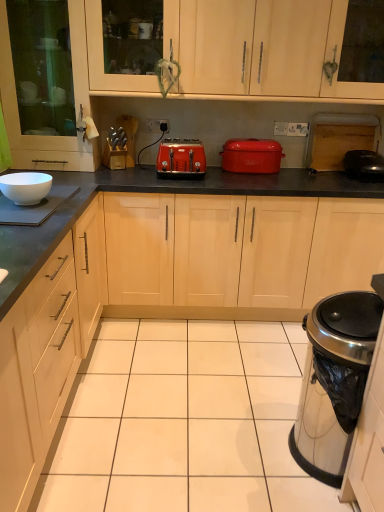
This screenshot has width=384, height=512. What are the coordinates of `matte wood cabinet at left, marked as the second cabinetry in a right-to-left arrangement` in the screenshot? It's located at (45, 84).

Looking at this image, measure the distance between black glossy pan at right, which is the third appliance in bottom-to-top order, and camera.

The distance of black glossy pan at right, which is the third appliance in bottom-to-top order, from camera is 8.03 feet.

This screenshot has width=384, height=512. What do you see at coordinates (364, 165) in the screenshot?
I see `black glossy pan at right, arranged as the 3th appliance when viewed from the left` at bounding box center [364, 165].

What do you see at coordinates (152, 192) in the screenshot? I see `black granite countertop at center` at bounding box center [152, 192].

You are a GUI agent. You are given a task and a screenshot of the screen. Output one action in this format:
    pyautogui.click(x=<x>, y=<y>)
    Task: Click on the matte wood cabinet at left, marked as the second cabinetry in a right-to-left arrangement
    The image size is (384, 512).
    Given the screenshot: What is the action you would take?
    pyautogui.click(x=45, y=84)

Looking at their sizes, would you say satin silver trash can at lower right, which ranks as the second appliance in right-to-left order, is wider or thinner than white plastic electric outlet at center?

Considering their sizes, satin silver trash can at lower right, which ranks as the second appliance in right-to-left order, looks broader than white plastic electric outlet at center.

Between satin silver trash can at lower right, the 3th appliance in the top-to-bottom sequence, and white plastic electric outlet at center, which one has smaller size?

Smaller between the two is white plastic electric outlet at center.

How different are the orientations of satin silver trash can at lower right, the third appliance in the back-to-front sequence, and white plastic electric outlet at center in degrees?

The angular difference between satin silver trash can at lower right, the third appliance in the back-to-front sequence, and white plastic electric outlet at center is 90.5 degrees.

From the picture: Which is correct: satin silver trash can at lower right, positioned as the 2th appliance in left-to-right order, is inside white plastic electric outlet at center, or outside of it?

satin silver trash can at lower right, positioned as the 2th appliance in left-to-right order, lies outside white plastic electric outlet at center.

Is there a large distance between black glossy pan at right, placed as the 1th appliance when sorted from right to left, and white matte bowl at left?

Yes, black glossy pan at right, placed as the 1th appliance when sorted from right to left, and white matte bowl at left are located far from each other.

Considering the relative sizes of black glossy pan at right, arranged as the 1th appliance when viewed from the back, and white matte bowl at left in the image provided, is black glossy pan at right, arranged as the 1th appliance when viewed from the back, bigger than white matte bowl at left?

Correct, black glossy pan at right, arranged as the 1th appliance when viewed from the back, is larger in size than white matte bowl at left.

Which of these two, black glossy pan at right, arranged as the 1th appliance when viewed from the back, or white matte bowl at left, stands shorter?

With less height is white matte bowl at left.

Is black glossy pan at right, placed as the first appliance when sorted from top to bottom, wider or thinner than white matte bowl at left?

black glossy pan at right, placed as the first appliance when sorted from top to bottom, is wider than white matte bowl at left.

Considering the positions of objects black granite countertop at center and matte wood cabinet at left, positioned as the 1th cabinetry in left-to-right order, in the image provided, who is in front, black granite countertop at center or matte wood cabinet at left, positioned as the 1th cabinetry in left-to-right order,?

matte wood cabinet at left, positioned as the 1th cabinetry in left-to-right order, is in front.

Find the location of a particular element. The width and height of the screenshot is (384, 512). countertop below the matte wood cabinet at left, marked as the second cabinetry in a right-to-left arrangement (from the image's perspective) is located at coordinates [x=152, y=192].

Looking at this image, is matte wood cabinet at left, positioned as the 1th cabinetry in left-to-right order, a part of black granite countertop at center?

No, black granite countertop at center does not contain matte wood cabinet at left, positioned as the 1th cabinetry in left-to-right order.

Between matte ceramic crockery at center and orange matte toaster at center, which one appears on the right side from the viewer's perspective?

matte ceramic crockery at center is more to the right.

Where is `toaster below the matte ceramic crockery at center (from the image's perspective)`? toaster below the matte ceramic crockery at center (from the image's perspective) is located at coordinates (181, 159).

How different are the orientations of matte ceramic crockery at center and orange matte toaster at center in degrees?

matte ceramic crockery at center and orange matte toaster at center are facing 0.0033 degrees away from each other.

Does matte ceramic crockery at center turn towards orange matte toaster at center?

No, matte ceramic crockery at center does not turn towards orange matte toaster at center.

Which object is wider, black granite countertop at center or matte ceramic crockery at center?

black granite countertop at center is wider.

From a real-world perspective, is black granite countertop at center physically located above or below matte ceramic crockery at center?

In terms of real-world spatial position, black granite countertop at center is below matte ceramic crockery at center.

Based on the photo, visually, is black granite countertop at center positioned to the left or to the right of matte ceramic crockery at center?

Based on their positions, black granite countertop at center is located to the left of matte ceramic crockery at center.

Is black granite countertop at center positioned in front of matte ceramic crockery at center?

Yes.

From the image's perspective, is black glossy pan at right, arranged as the 3th appliance when viewed from the left, positioned above or below white plastic electric outlet at center?

From the image's perspective, black glossy pan at right, arranged as the 3th appliance when viewed from the left, appears below white plastic electric outlet at center.

Does point (378, 154) appear closer or farther from the camera than point (167, 125)?

Point (378, 154) is closer to the camera than point (167, 125).

From the image's perspective, count 1st appliances downward from the white plastic electric outlet at center and point to it. Please provide its 2D coordinates.

[(364, 165)]

In the scene shown: Can you confirm if white matte bowl at left is taller than light wood cabinet at upper center, which is counted as the 1th cabinetry, starting from the right?

In fact, white matte bowl at left may be shorter than light wood cabinet at upper center, which is counted as the 1th cabinetry, starting from the right.

At what (x,y) coordinates should I click in order to perform the action: click on bowl on the left of the light wood cabinet at upper center, which is counted as the 1th cabinetry, starting from the right. Please return your answer as a coordinate pair (x, y). Looking at the image, I should click on (25, 187).

From the image's perspective, who appears lower, white matte bowl at left or light wood cabinet at upper center, which is counted as the 1th cabinetry, starting from the right?

From the image's view, white matte bowl at left is below.

Is white matte bowl at left not near light wood cabinet at upper center, which ranks as the 2th cabinetry in left-to-right order?

Absolutely, white matte bowl at left is distant from light wood cabinet at upper center, which ranks as the 2th cabinetry in left-to-right order.

Where is `the 3rd appliance in front of the white plastic electric outlet at center`? Image resolution: width=384 pixels, height=512 pixels. the 3rd appliance in front of the white plastic electric outlet at center is located at coordinates (334, 381).

Find the location of `bowl that appears below the black glossy pan at right, arranged as the 1th appliance when viewed from the back (from the image's perspective)`. bowl that appears below the black glossy pan at right, arranged as the 1th appliance when viewed from the back (from the image's perspective) is located at coordinates tap(25, 187).

Based on their spatial positions, is white plastic electric outlet at center or white matte bowl at left further from matte wood cabinet at left, positioned as the 1th cabinetry in left-to-right order?

The object further to matte wood cabinet at left, positioned as the 1th cabinetry in left-to-right order, is white matte bowl at left.

Based on their spatial positions, is matte ceramic crockery at center or black glossy pan at right, placed as the 1th appliance when sorted from right to left, closer to orange matte toaster at center?

matte ceramic crockery at center.

Considering their positions, is matte wood cabinet at left, marked as the second cabinetry in a right-to-left arrangement, positioned closer to satin silver trash can at lower right, which ranks as the second appliance in right-to-left order, than light wood cabinet at upper center, which is counted as the 1th cabinetry, starting from the right?

light wood cabinet at upper center, which is counted as the 1th cabinetry, starting from the right, lies closer to satin silver trash can at lower right, which ranks as the second appliance in right-to-left order, than the other object.

Based on their spatial positions, is satin silver trash can at lower right, the 3th appliance in the top-to-bottom sequence, or black granite countertop at center further from orange matte toaster at center?

Based on the image, satin silver trash can at lower right, the 3th appliance in the top-to-bottom sequence, appears to be further to orange matte toaster at center.

From the picture: Based on their spatial positions, is white matte bowl at left or black glossy pan at right, placed as the 1th appliance when sorted from right to left, further from white glossy bowl at left, the 2th appliance positioned from the back?

A: black glossy pan at right, placed as the 1th appliance when sorted from right to left, lies further to white glossy bowl at left, the 2th appliance positioned from the back, than the other object.

When comparing their distances from light wood cabinet at upper center, which ranks as the 2th cabinetry in left-to-right order, does white matte bowl at left or orange matte toaster at center seem closer?

orange matte toaster at center is positioned closer to the anchor light wood cabinet at upper center, which ranks as the 2th cabinetry in left-to-right order.

Based on their spatial positions, is orange matte toaster at center or white plastic electric outlet at center further from white glossy bowl at left, the 2th appliance ordered from the bottom?

The object further to white glossy bowl at left, the 2th appliance ordered from the bottom, is white plastic electric outlet at center.

Looking at the image, which one is located further to matte ceramic crockery at center, black granite countertop at center or white glossy bowl at left, the 2th appliance ordered from the bottom?

white glossy bowl at left, the 2th appliance ordered from the bottom, is positioned further to the anchor matte ceramic crockery at center.

What are the coordinates of `toaster between satin silver trash can at lower right, the first appliance from the bottom, and matte ceramic crockery at center in the front-back direction` in the screenshot? It's located at (181, 159).

Find the location of a particular element. bowl located between white glossy bowl at left, placed as the 2th appliance when sorted from top to bottom, and black granite countertop at center in the left-right direction is located at coordinates (25, 187).

Where is `electric outlet between white matte bowl at left and light wood cabinet at upper center, which ranks as the 2th cabinetry in left-to-right order, from left to right`? electric outlet between white matte bowl at left and light wood cabinet at upper center, which ranks as the 2th cabinetry in left-to-right order, from left to right is located at coordinates (156, 125).

Identify the location of kitchen appliance between light wood cabinet at upper center, which is counted as the 1th cabinetry, starting from the right, and satin silver trash can at lower right, the 3th appliance in the top-to-bottom sequence, from top to bottom. (251, 155).